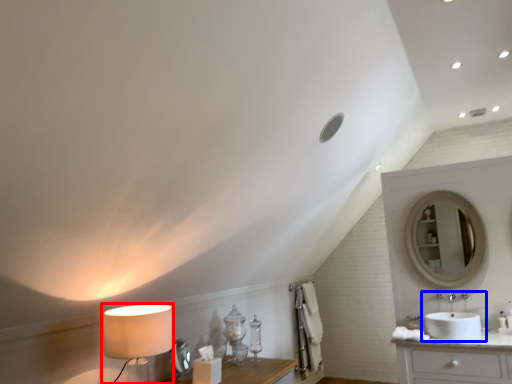
Question: Which point is closer to the camera, table lamp (highlighted by a red box) or sink (highlighted by a blue box)?

Choices:
 (A) table lamp
 (B) sink

Answer: (A)